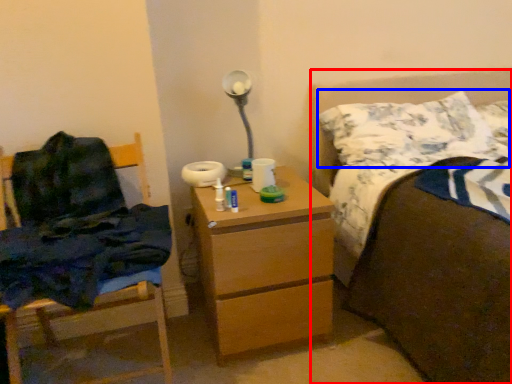
Question: Which point is closer to the camera, bed (highlighted by a red box) or pillow (highlighted by a blue box)?

Choices:
 (A) bed
 (B) pillow

Answer: (A)